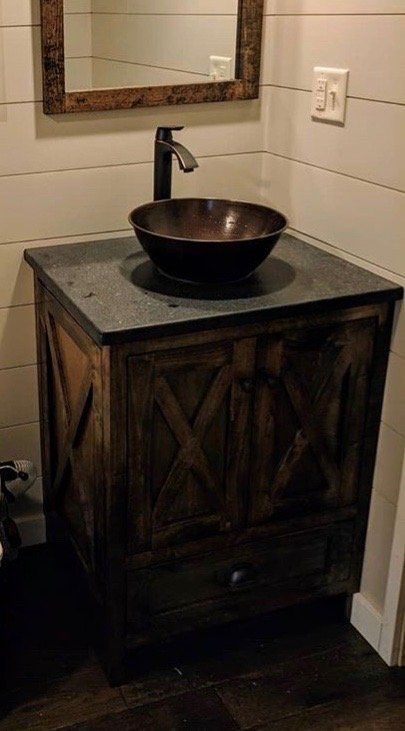
Find the location of `sink`. sink is located at coordinates (200, 227).